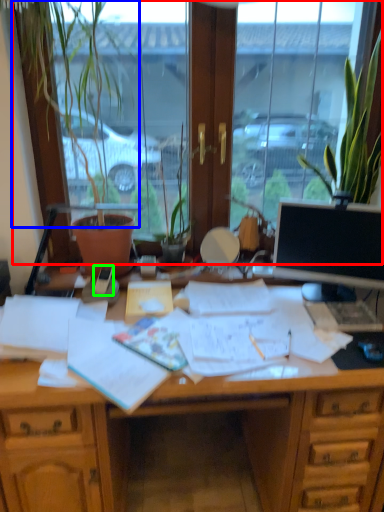
Question: Which object is positioned closest to window (highlighted by a red box)? Select from plant (highlighted by a blue box) and mobile phone (highlighted by a green box).

Choices:
 (A) plant
 (B) mobile phone

Answer: (A)